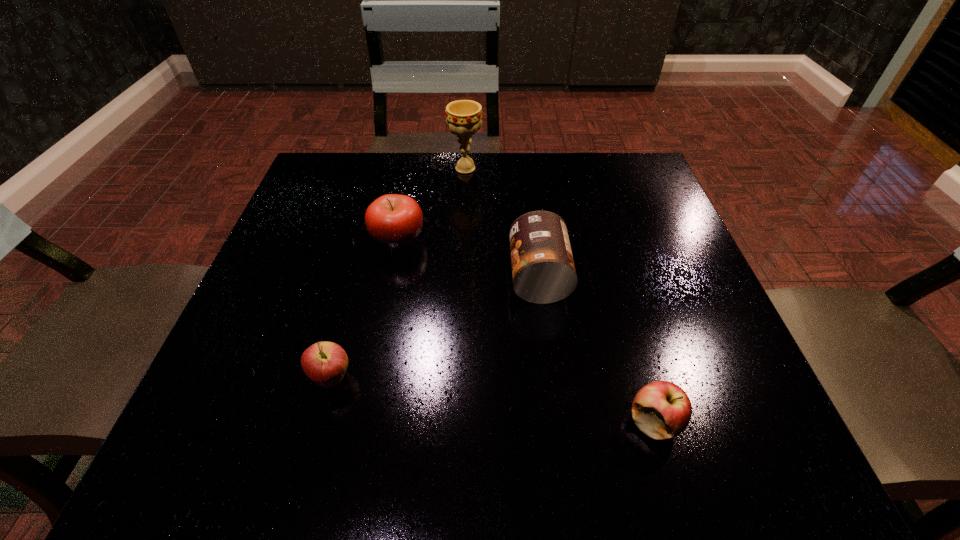
Where is `the third object from right to left`? This screenshot has height=540, width=960. the third object from right to left is located at coordinates click(463, 117).

This screenshot has width=960, height=540. In order to click on the farthest object in this screenshot , I will do `click(463, 117)`.

Locate an element on the screen. This screenshot has width=960, height=540. the farthest apple is located at coordinates (394, 221).

Image resolution: width=960 pixels, height=540 pixels. Identify the location of can. (543, 271).

Identify the location of the second nearest apple. Image resolution: width=960 pixels, height=540 pixels. (325, 363).

Locate an element on the screen. The image size is (960, 540). the rightmost object is located at coordinates (662, 410).

The height and width of the screenshot is (540, 960). I want to click on the nearest apple, so click(662, 410).

Image resolution: width=960 pixels, height=540 pixels. Find the location of `free space located on the front of the tallest object`. free space located on the front of the tallest object is located at coordinates (463, 231).

Find the location of a particular element. Image resolution: width=960 pixels, height=540 pixels. free point located 0.290m on the front of the farthest apple is located at coordinates (369, 388).

At what (x,y) coordinates should I click in order to perform the action: click on free space located 0.080m on the front label of the can. Please return your answer as a coordinate pair (x, y). Looking at the image, I should click on (468, 276).